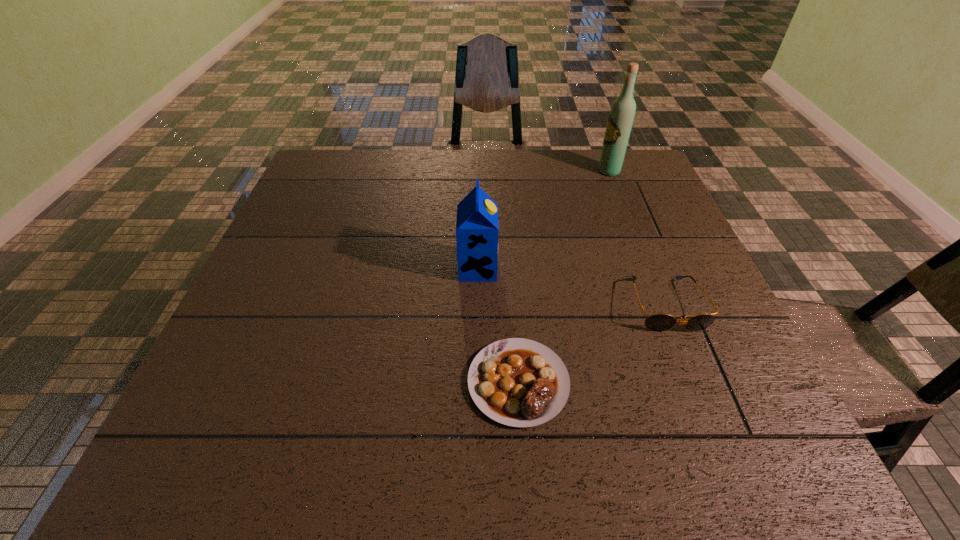
Where is `blank space located 0.150m on the front-facing side of the sunglasses`? blank space located 0.150m on the front-facing side of the sunglasses is located at coordinates (703, 399).

Where is `blank space located on the right of the steak`? blank space located on the right of the steak is located at coordinates (755, 382).

This screenshot has height=540, width=960. I want to click on object located at the far edge, so click(x=621, y=116).

Locate an element on the screen. This screenshot has height=540, width=960. object present at the near edge is located at coordinates (517, 382).

The width and height of the screenshot is (960, 540). In order to click on wine bottle at the right edge in this screenshot , I will do `click(621, 116)`.

You are a GUI agent. You are given a task and a screenshot of the screen. Output one action in this format:
    pyautogui.click(x=<x>, y=<y>)
    Task: Click on the sunglasses that is at the right edge
    
    Given the screenshot: What is the action you would take?
    pyautogui.click(x=656, y=322)

Where is `object present at the far right corner`? The width and height of the screenshot is (960, 540). object present at the far right corner is located at coordinates [x=621, y=116].

In the image, there is a desktop. What are the coordinates of `vacant space at the far edge` in the screenshot? It's located at (425, 174).

This screenshot has height=540, width=960. In order to click on vacant point at the near edge in this screenshot , I will do [260, 472].

The image size is (960, 540). Identify the location of vacant space at the left edge. point(333,212).